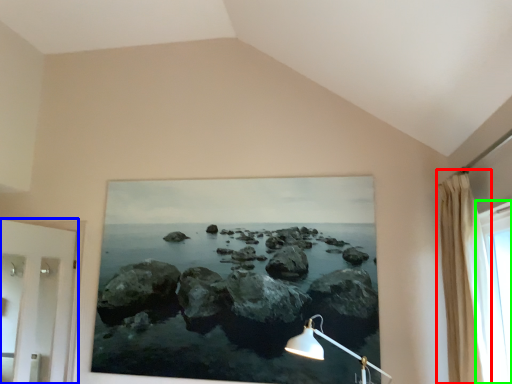
Question: Which object is the farthest from curtain (highlighted by a red box)? Choose among these: door (highlighted by a blue box) or window (highlighted by a green box).

Choices:
 (A) door
 (B) window

Answer: (A)